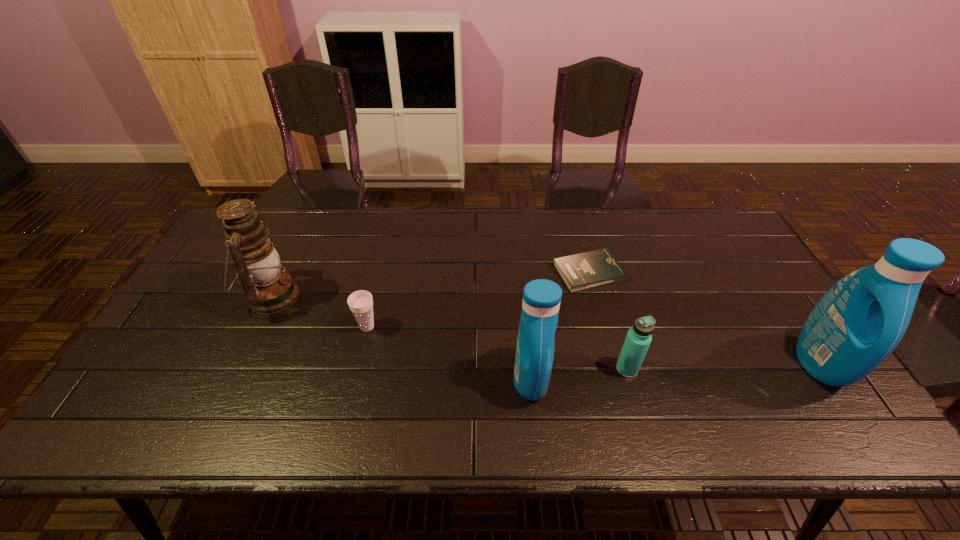
Locate an element on the screen. This screenshot has width=960, height=540. vacant region between the fifth object from right to left and the fourth tallest object is located at coordinates click(x=497, y=348).

You are a GUI agent. You are given a task and a screenshot of the screen. Output one action in this format:
    pyautogui.click(x=<x>, y=<y>)
    Task: Click on the vacant area that lies between the shortest object and the shorter detergent
    Image resolution: width=960 pixels, height=540 pixels.
    Given the screenshot: What is the action you would take?
    pyautogui.click(x=560, y=326)

The width and height of the screenshot is (960, 540). What are the coordinates of `the fourth closest object to the book` in the screenshot? It's located at (360, 302).

Identify the location of object that stands as the fourth closest to the cup. (638, 339).

Locate an element on the screen. The height and width of the screenshot is (540, 960). free space that satisfies the following two spatial constraints: 1. on the front side of the thermos bottle; 2. on the front-facing side of the shorter detergent is located at coordinates (630, 379).

Identify the location of vacant space that satisfies the following two spatial constraints: 1. on the front side of the thermos bottle; 2. on the front-facing side of the left detergent. (630, 379).

The height and width of the screenshot is (540, 960). Find the location of `free spot that satisfies the following two spatial constraints: 1. on the front side of the fourth tallest object; 2. on the right side of the cup`. free spot that satisfies the following two spatial constraints: 1. on the front side of the fourth tallest object; 2. on the right side of the cup is located at coordinates (357, 369).